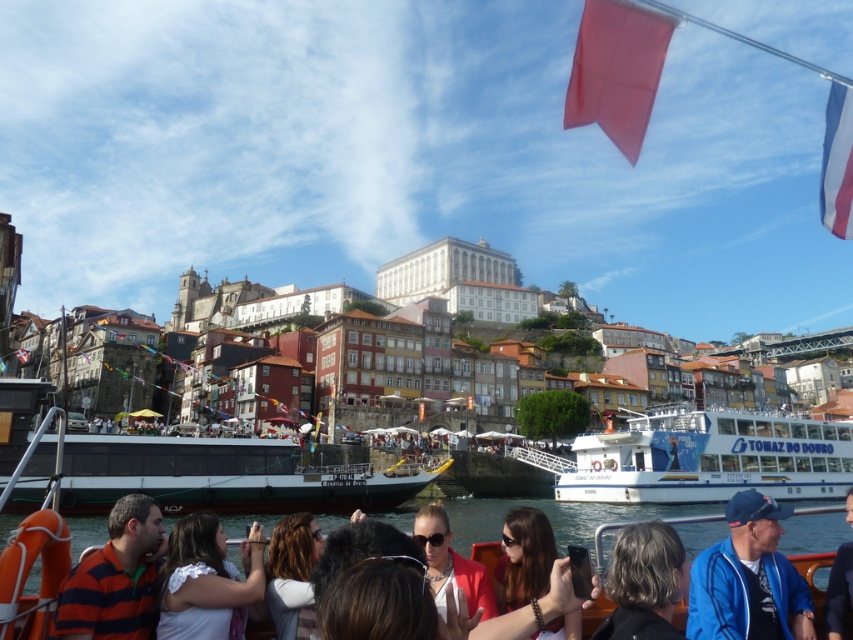
Question: Estimate the real-world distances between objects in this image. Which object is farther from the red fabric flag at upper right?

Choices:
 (A) striped cotton shirt at lower left
 (B) matte pink jacket at center

Answer: (A)

Question: Does matte black hair at center appear under white fabric flag at upper right?

Choices:
 (A) no
 (B) yes

Answer: (B)

Question: Is clear blue water at center closer to the viewer compared to blue fabric jacket at lower right?

Choices:
 (A) no
 (B) yes

Answer: (A)

Question: Which point is farther to the camera?

Choices:
 (A) matte black hair at center
 (B) red fabric flag at upper right

Answer: (B)

Question: Is white glossy boat at lower right wider than light brown hair at center?

Choices:
 (A) no
 (B) yes

Answer: (B)

Question: Which of the following is the farthest from the observer?

Choices:
 (A) (682, 465)
 (B) (848, 564)
 (C) (438, 518)
 (D) (850, 172)

Answer: (A)